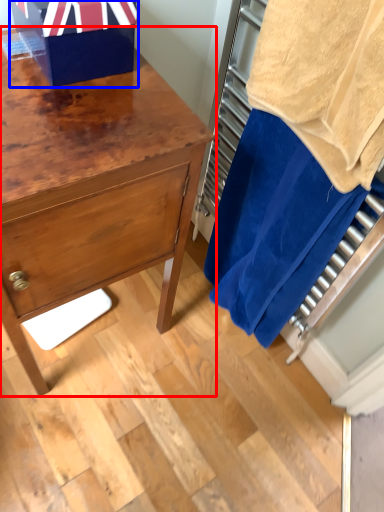
Question: Which of the following is the closest to the observer, chest of drawers (highlighted by a red box) or gift box (highlighted by a blue box)?

Choices:
 (A) chest of drawers
 (B) gift box

Answer: (A)